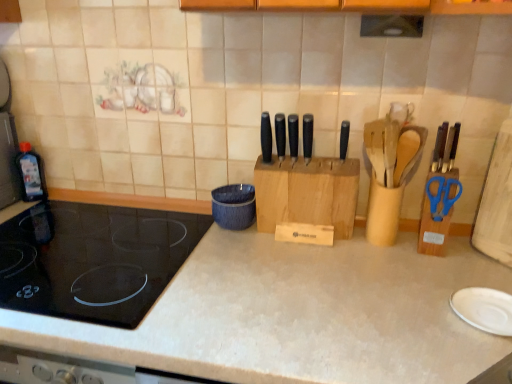
Measure the distance between black glass cooktop at left and camera.

black glass cooktop at left and camera are 31.12 inches apart.

This screenshot has height=384, width=512. What do you see at coordinates (307, 193) in the screenshot? I see `wooden knife block at center` at bounding box center [307, 193].

What do you see at coordinates (293, 136) in the screenshot? I see `black matte knife at center, the third knife positioned from the left` at bounding box center [293, 136].

Locate an element on the screen. white matte countertop at center is located at coordinates (297, 315).

From the image's perspective, is blue plastic scissors at right under blue textured bowl at center?

Actually, blue plastic scissors at right appears above blue textured bowl at center in the image.

From their relative heights in the image, would you say blue plastic scissors at right is taller or shorter than blue textured bowl at center?

blue plastic scissors at right is taller than blue textured bowl at center.

Can you see blue plastic scissors at right touching blue textured bowl at center?

There is a gap between blue plastic scissors at right and blue textured bowl at center.

Which object is further away from the camera, blue plastic scissors at right or blue textured bowl at center?

blue textured bowl at center is further from the camera.

From the image's perspective, which object appears higher, black glass cooktop at left or wooden knife block at center?

wooden knife block at center, from the image's perspective.

From a real-world perspective, is black glass cooktop at left positioned under wooden knife block at center based on gravity?

Yes, from a real-world perspective, black glass cooktop at left is beneath wooden knife block at center.

Find the location of `gas stove directly beneath the wooden knife block at center (from a real-world perspective)`. gas stove directly beneath the wooden knife block at center (from a real-world perspective) is located at coordinates (93, 260).

Does black glass cooktop at left have a lesser height compared to wooden knife block at center?

Correct, black glass cooktop at left is not as tall as wooden knife block at center.

Is blue plastic scissors at right aimed at black plastic knife at center, which is the 2th knife from left to right?

No, blue plastic scissors at right is not aimed at black plastic knife at center, which is the 2th knife from left to right.

Based on their sizes in the image, would you say blue plastic scissors at right is bigger or smaller than black plastic knife at center, which is counted as the fourth knife, starting from the right?

In the image, blue plastic scissors at right appears to be larger than black plastic knife at center, which is counted as the fourth knife, starting from the right.

In the scene shown: Does blue plastic scissors at right touch black plastic knife at center, which is the 2th knife from left to right?

No, blue plastic scissors at right is not making contact with black plastic knife at center, which is the 2th knife from left to right.

From their relative heights in the image, would you say blue plastic scissors at right is taller or shorter than black plastic knife at center, which is the 2th knife from left to right?

blue plastic scissors at right is shorter than black plastic knife at center, which is the 2th knife from left to right.

In the scene shown: Is black matte knife at center, which appears as the 5th knife when viewed from the right, smaller than blue textured bowl at center?

Yes.

Is black matte knife at center, which appears as the 5th knife when viewed from the right, facing away from blue textured bowl at center?

That's not correct — black matte knife at center, which appears as the 5th knife when viewed from the right, is not looking away from blue textured bowl at center.

Is black matte knife at center, arranged as the first knife when viewed from the left, shorter than blue textured bowl at center?

In fact, black matte knife at center, arranged as the first knife when viewed from the left, may be taller than blue textured bowl at center.

From a real-world perspective, which knife is the 4th one underneath the black matte knife at center, arranged as the first knife when viewed from the left? Please provide its 2D coordinates.

[(344, 139)]

Relative to black matte knife at center, marked as the first knife in a right-to-left arrangement, is black matte knife at center, which appears as the 5th knife when viewed from the right, in front or behind?

black matte knife at center, which appears as the 5th knife when viewed from the right, is positioned farther from the viewer than black matte knife at center, marked as the first knife in a right-to-left arrangement.

From a real-world perspective, which object stands above the other?

black matte knife at center, arranged as the first knife when viewed from the left, from a real-world perspective.

Looking at this image, is black matte knife at center, which appears as the 5th knife when viewed from the right, oriented towards black matte knife at center, arranged as the fifth knife when viewed from the left?

No, black matte knife at center, which appears as the 5th knife when viewed from the right, is not oriented towards black matte knife at center, arranged as the fifth knife when viewed from the left.

Does blue textured bowl at center have a greater width compared to black matte knife at center, which is the third knife from right to left?

Indeed, blue textured bowl at center has a greater width compared to black matte knife at center, which is the third knife from right to left.

Which is correct: blue textured bowl at center is inside black matte knife at center, the third knife positioned from the left, or outside of it?

blue textured bowl at center is spatially situated outside black matte knife at center, the third knife positioned from the left.

From a real-world perspective, relative to black matte knife at center, which is the third knife from right to left, is blue textured bowl at center vertically above or below?

In terms of real-world spatial position, blue textured bowl at center is below black matte knife at center, which is the third knife from right to left.

From a real-world perspective, who is located higher, white matte countertop at center or black matte knife at center, arranged as the first knife when viewed from the left?

From a 3D spatial view, black matte knife at center, arranged as the first knife when viewed from the left, is above.

Is black matte knife at center, arranged as the first knife when viewed from the left, at the back of white matte countertop at center?

white matte countertop at center is not turned away from black matte knife at center, arranged as the first knife when viewed from the left.

Which object is thinner, white matte countertop at center or black matte knife at center, which appears as the 5th knife when viewed from the right?

black matte knife at center, which appears as the 5th knife when viewed from the right.

Can you confirm if white matte countertop at center is shorter than black matte knife at center, which appears as the 5th knife when viewed from the right?

In fact, white matte countertop at center may be taller than black matte knife at center, which appears as the 5th knife when viewed from the right.

Where is `scissors on the right side of blue textured bowl at center`? The height and width of the screenshot is (384, 512). scissors on the right side of blue textured bowl at center is located at coordinates (442, 196).

Where is `cardboard box that appears above the black glass cooktop at left (from a real-world perspective)`? Image resolution: width=512 pixels, height=384 pixels. cardboard box that appears above the black glass cooktop at left (from a real-world perspective) is located at coordinates (307, 193).

From the image, which object appears to be farther from white matte countertop at center, black matte knife at center, the third knife positioned from the left, or wooden knife block at center?

black matte knife at center, the third knife positioned from the left, is further to white matte countertop at center.

From the image, which object appears to be nearer to transparent plastic bottle at left, black matte knife at center, which is the fourth knife in left-to-right order, or black glass cooktop at left?

Among the two, black glass cooktop at left is located nearer to transparent plastic bottle at left.

Which object lies further to the anchor point black matte knife at center, arranged as the first knife when viewed from the left, black matte knife at center, the third knife positioned from the left, or black glass cooktop at left?

black glass cooktop at left is positioned further to the anchor black matte knife at center, arranged as the first knife when viewed from the left.

From the image, which object appears to be farther from black glass cooktop at left, blue textured bowl at center or white matte countertop at center?

blue textured bowl at center lies further to black glass cooktop at left than the other object.

Which object lies nearer to the anchor point black plastic knife at center, which is the 2th knife from left to right, transparent plastic bottle at left or black glass cooktop at left?

The object closer to black plastic knife at center, which is the 2th knife from left to right, is black glass cooktop at left.

Looking at the image, which one is located closer to black glass cooktop at left, black matte knife at center, arranged as the first knife when viewed from the left, or blue textured bowl at center?

blue textured bowl at center.

When comparing their distances from wooden knife block at center, does black matte knife at center, marked as the first knife in a right-to-left arrangement, or transparent plastic bottle at left seem closer?

Result: Among the two, black matte knife at center, marked as the first knife in a right-to-left arrangement, is located nearer to wooden knife block at center.

When comparing their distances from black matte knife at center, which appears as the second knife when viewed from the right, does transparent plastic bottle at left or black plastic knife at center, which is counted as the fourth knife, starting from the right, seem closer?

The object closer to black matte knife at center, which appears as the second knife when viewed from the right, is black plastic knife at center, which is counted as the fourth knife, starting from the right.

This screenshot has width=512, height=384. I want to click on gas stove between black plastic knife at center, which is the 2th knife from left to right, and white matte countertop at center vertically, so click(93, 260).

Where is `gas stove located between transparent plastic bottle at left and black plastic knife at center, which is the 2th knife from left to right, in the left-right direction`? Image resolution: width=512 pixels, height=384 pixels. gas stove located between transparent plastic bottle at left and black plastic knife at center, which is the 2th knife from left to right, in the left-right direction is located at coordinates (93, 260).

I want to click on cardboard box located between black plastic knife at center, which is the 2th knife from left to right, and black matte knife at center, arranged as the fifth knife when viewed from the left, in the left-right direction, so point(307,193).

The image size is (512, 384). Find the location of `cardboard box between black plastic knife at center, which is counted as the fourth knife, starting from the right, and white matte countertop at center from top to bottom`. cardboard box between black plastic knife at center, which is counted as the fourth knife, starting from the right, and white matte countertop at center from top to bottom is located at coordinates (307, 193).